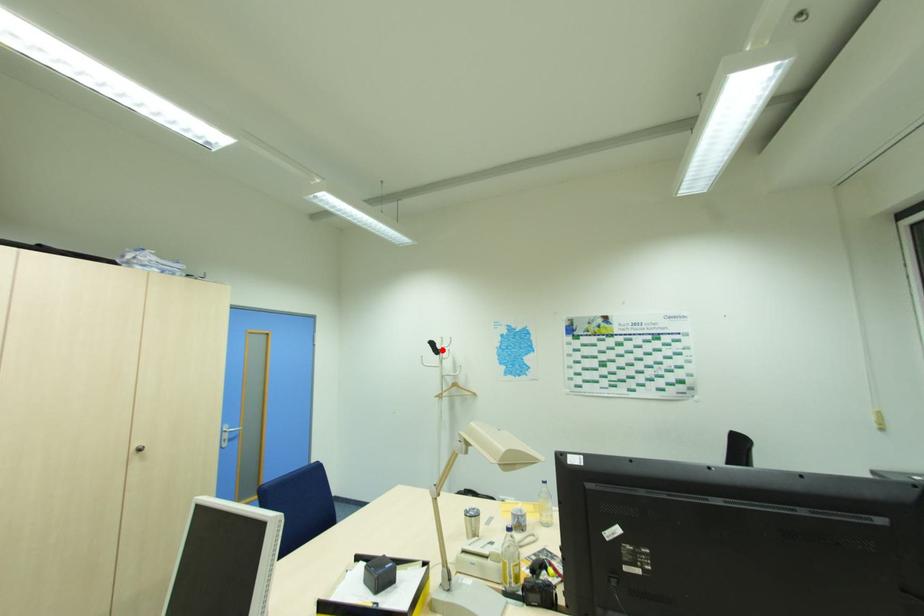
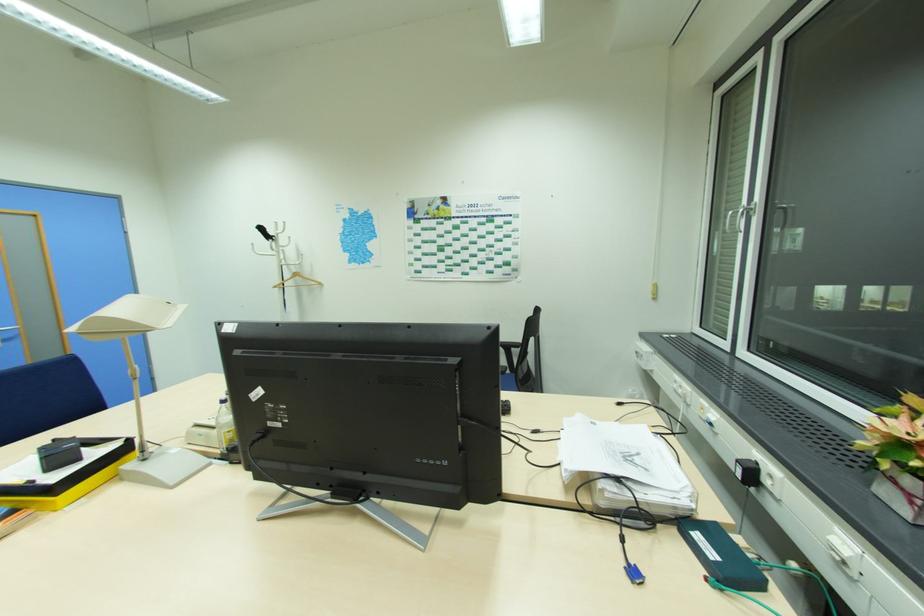
Find the pixel in the second image that matches the highlighted location in the first image.

(276, 237)